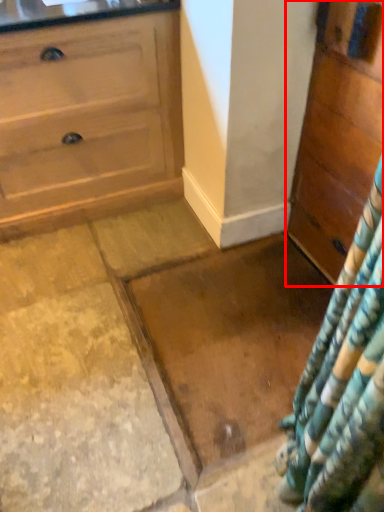
Question: Where is chest of drawers (annotated by the red box) located in relation to granite in the image?

Choices:
 (A) left
 (B) right

Answer: (B)